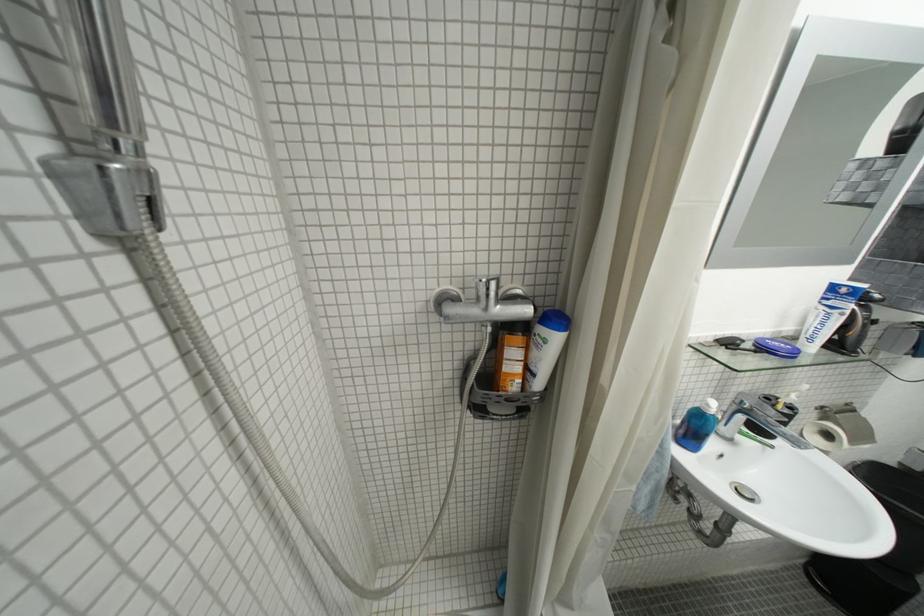
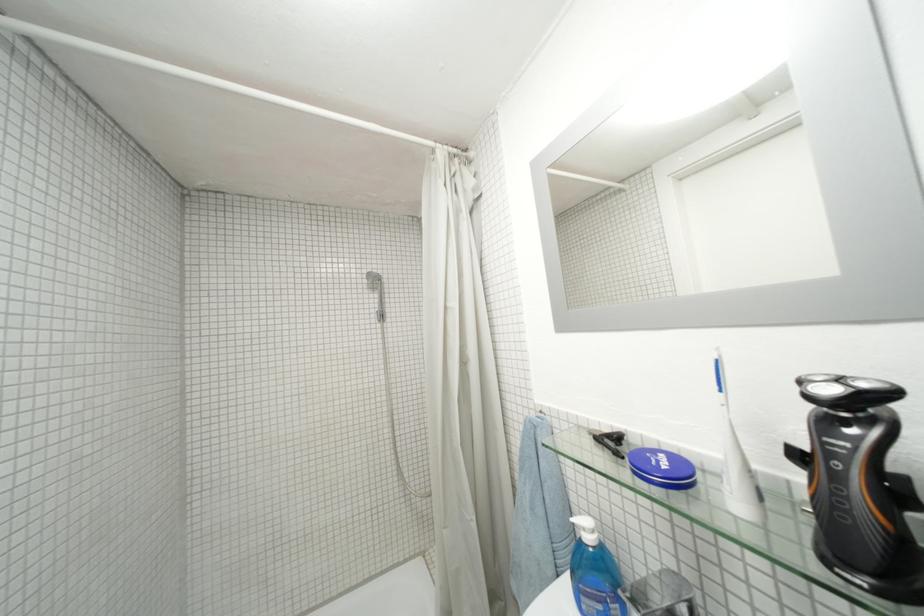
Question: I am providing you with two images of the same scene from different viewpoints. Please identify which objects are invisible in image2.

Choices:
 (A) white bar of soap
 (B) black razor attachment
 (C) black electric razor
 (D) chrome faucet handle

Answer: (D)